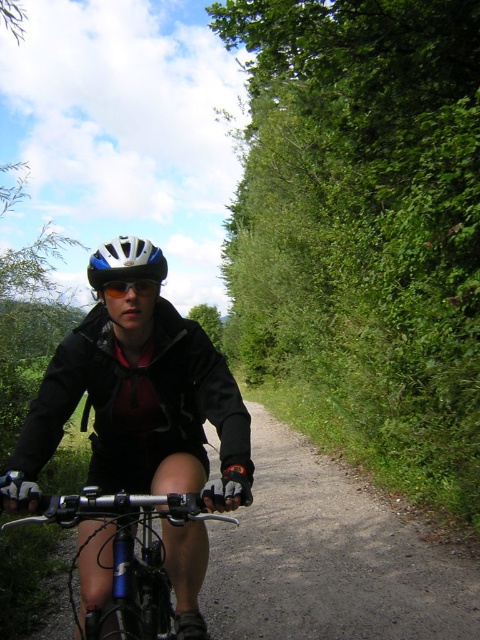
Question: Can you confirm if matte black jacket at center is positioned to the left of blue metallic bicycle at center?

Choices:
 (A) no
 (B) yes

Answer: (A)

Question: Which of the following is the closest to the observer?

Choices:
 (A) white matte bicycle helmet at center
 (B) blue metallic bicycle at center
 (C) matte black jacket at center

Answer: (B)

Question: Among these objects, which one is farthest from the camera?

Choices:
 (A) white matte bicycle helmet at center
 (B) matte black jacket at center

Answer: (A)

Question: Which point is farther from the camera taking this photo?

Choices:
 (A) (162, 486)
 (B) (154, 509)
 (C) (160, 280)

Answer: (C)

Question: Is blue metallic bicycle at center wider than white matte bicycle helmet at center?

Choices:
 (A) no
 (B) yes

Answer: (A)

Question: Is the position of matte black jacket at center more distant than that of white matte bicycle helmet at center?

Choices:
 (A) no
 (B) yes

Answer: (A)